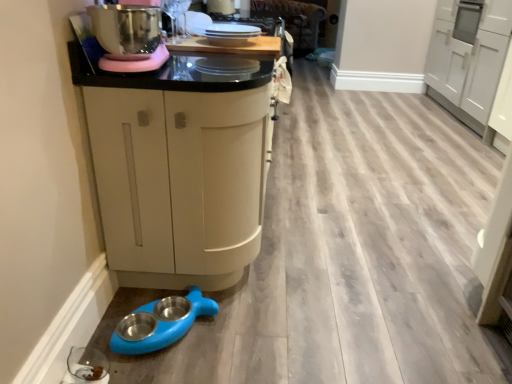
Locate an element on the screen. blue rubber pet bowls at lower left is located at coordinates (160, 323).

Measure the distance between point (203, 29) and camera.

Point (203, 29) is 6.51 feet from camera.

Locate an element on the screen. matte cream cabinet at center, which ranks as the 2th cabinetry in back-to-front order is located at coordinates (178, 169).

This screenshot has height=384, width=512. I want to click on white glossy cabinet at upper right, arranged as the 1th cabinetry when viewed from the right, so click(468, 57).

Considering the points (106, 372) and (440, 36), which point is behind, point (106, 372) or point (440, 36)?

The point (440, 36) is more distant.

Measure the distance between transparent glass bowl at lower left, which is the second appliance from right to left, and white glossy cabinet at upper right, which is the 1th cabinetry from back to front.

3.94 meters.

Which is in front, transparent glass bowl at lower left, acting as the second appliance starting from the top, or white glossy cabinet at upper right, the second cabinetry positioned from the left?

transparent glass bowl at lower left, acting as the second appliance starting from the top, is more forward.

Considering the sizes of objects transparent glass bowl at lower left, positioned as the 1th appliance in front-to-back order, and white glossy cabinet at upper right, which is the 1th cabinetry from back to front, in the image provided, who is thinner, transparent glass bowl at lower left, positioned as the 1th appliance in front-to-back order, or white glossy cabinet at upper right, which is the 1th cabinetry from back to front,?

With smaller width is transparent glass bowl at lower left, positioned as the 1th appliance in front-to-back order.

Considering the sizes of objects transparent glass bowl at lower left, the 2th appliance when ordered from back to front, and blue rubber pet bowls at lower left in the image provided, who is smaller, transparent glass bowl at lower left, the 2th appliance when ordered from back to front, or blue rubber pet bowls at lower left?

transparent glass bowl at lower left, the 2th appliance when ordered from back to front, is smaller.

Measure the distance between transparent glass bowl at lower left, the 2th appliance when ordered from back to front, and blue rubber pet bowls at lower left.

7.61 inches.

Looking at this image, is transparent glass bowl at lower left, which is counted as the first appliance, starting from the bottom, situated inside blue rubber pet bowls at lower left or outside?

transparent glass bowl at lower left, which is counted as the first appliance, starting from the bottom, is located beyond the bounds of blue rubber pet bowls at lower left.

From the image's perspective, which object appears higher, transparent glass bowl at lower left, which is the second appliance from right to left, or blue rubber pet bowls at lower left?

blue rubber pet bowls at lower left.

Where is `cabinetry lying in front of the white glossy cabinet at upper right, arranged as the 1th cabinetry when viewed from the right`? This screenshot has width=512, height=384. cabinetry lying in front of the white glossy cabinet at upper right, arranged as the 1th cabinetry when viewed from the right is located at coordinates (178, 169).

In terms of width, does matte cream cabinet at center, which is the first cabinetry from left to right, look wider or thinner when compared to white glossy cabinet at upper right, arranged as the 1th cabinetry when viewed from the right?

In the image, matte cream cabinet at center, which is the first cabinetry from left to right, appears to be more narrow than white glossy cabinet at upper right, arranged as the 1th cabinetry when viewed from the right.

Based on the photo, is white glossy cabinet at upper right, which is the 1th cabinetry from back to front, at the back of matte cream cabinet at center, the 2th cabinetry from the right?

That's not correct — matte cream cabinet at center, the 2th cabinetry from the right, is not looking away from white glossy cabinet at upper right, which is the 1th cabinetry from back to front.

From the image's perspective, which object appears higher, matte cream cabinet at center, which ranks as the 2th cabinetry in back-to-front order, or white glossy cabinet at upper right, arranged as the 1th cabinetry when viewed from the right?

white glossy cabinet at upper right, arranged as the 1th cabinetry when viewed from the right.

In the scene shown: Would you say wooden surface at upper center is part of blue rubber pet bowls at lower left's contents?

Actually, wooden surface at upper center is outside blue rubber pet bowls at lower left.

Is blue rubber pet bowls at lower left in contact with wooden surface at upper center?

blue rubber pet bowls at lower left and wooden surface at upper center are clearly separated.

From the image's perspective, is blue rubber pet bowls at lower left above wooden surface at upper center?

No, from the image's perspective, blue rubber pet bowls at lower left is not above wooden surface at upper center.

Would you say wooden surface at upper center is a long distance from white glossy cabinet at upper right, arranged as the 1th cabinetry when viewed from the right?

wooden surface at upper center is far away from white glossy cabinet at upper right, arranged as the 1th cabinetry when viewed from the right.

Is wooden surface at upper center oriented away from white glossy cabinet at upper right, the second cabinetry positioned from the left?

No, wooden surface at upper center is not facing the opposite direction of white glossy cabinet at upper right, the second cabinetry positioned from the left.

Considering the positions of objects wooden surface at upper center and white glossy cabinet at upper right, which appears as the 2th cabinetry when viewed from the front, in the image provided, who is more to the right, wooden surface at upper center or white glossy cabinet at upper right, which appears as the 2th cabinetry when viewed from the front,?

From the viewer's perspective, white glossy cabinet at upper right, which appears as the 2th cabinetry when viewed from the front, appears more on the right side.

From the image's perspective, relative to white glossy cabinet at upper right, the second cabinetry positioned from the left, is wooden surface at upper center above or below?

From the image's perspective, wooden surface at upper center appears below white glossy cabinet at upper right, the second cabinetry positioned from the left.

Is white glossy cabinet at upper right, which appears as the 2th cabinetry when viewed from the front, in front of or behind wooden surface at upper center in the image?

Visually, white glossy cabinet at upper right, which appears as the 2th cabinetry when viewed from the front, is located behind wooden surface at upper center.

Is white glossy cabinet at upper right, which is the 1th cabinetry from back to front, aimed at wooden surface at upper center?

No, white glossy cabinet at upper right, which is the 1th cabinetry from back to front, is not facing towards wooden surface at upper center.

Which of these two, white glossy cabinet at upper right, arranged as the 1th cabinetry when viewed from the right, or wooden surface at upper center, stands shorter?

Standing shorter between the two is wooden surface at upper center.

Is white glossy cabinet at upper right, which appears as the 2th cabinetry when viewed from the front, bigger than wooden surface at upper center?

Yes, white glossy cabinet at upper right, which appears as the 2th cabinetry when viewed from the front, is bigger than wooden surface at upper center.

Is white glossy plates at upper center, placed as the second appliance when sorted from bottom to top, inside or outside of transparent glass bowl at lower left, which is counted as the first appliance, starting from the bottom?

white glossy plates at upper center, placed as the second appliance when sorted from bottom to top, cannot be found inside transparent glass bowl at lower left, which is counted as the first appliance, starting from the bottom.

Is white glossy plates at upper center, positioned as the first appliance in top-to-bottom order, next to transparent glass bowl at lower left, the 2th appliance when ordered from back to front, and touching it?

No, white glossy plates at upper center, positioned as the first appliance in top-to-bottom order, is not beside transparent glass bowl at lower left, the 2th appliance when ordered from back to front.

This screenshot has width=512, height=384. In order to click on appliance above the transparent glass bowl at lower left, positioned as the 1th appliance in front-to-back order (from the image's perspective) in this screenshot , I will do `click(229, 33)`.

From a real-world perspective, which cabinetry is the 2nd one above the transparent glass bowl at lower left, positioned as the 1th appliance in front-to-back order? Please provide its 2D coordinates.

[(468, 57)]

Locate an element on the screen. The width and height of the screenshot is (512, 384). appliance on the left of blue rubber pet bowls at lower left is located at coordinates click(86, 366).

Based on the photo, based on their spatial positions, is transparent glass bowl at lower left, the 2th appliance when ordered from back to front, or matte cream cabinet at center, which ranks as the 2th cabinetry in back-to-front order, closer to wooden surface at upper center?

matte cream cabinet at center, which ranks as the 2th cabinetry in back-to-front order, is positioned closer to the anchor wooden surface at upper center.

Estimate the real-world distances between objects in this image. Which object is further from matte cream cabinet at center, which is the first cabinetry from left to right, white glossy plates at upper center, which is the 1th appliance in right-to-left order, or wooden surface at upper center?

white glossy plates at upper center, which is the 1th appliance in right-to-left order, is positioned further to the anchor matte cream cabinet at center, which is the first cabinetry from left to right.

Based on their spatial positions, is white glossy cabinet at upper right, the second cabinetry positioned from the left, or matte cream cabinet at center, which ranks as the 2th cabinetry in back-to-front order, closer to white glossy plates at upper center, arranged as the first appliance when viewed from the back?

Based on the image, matte cream cabinet at center, which ranks as the 2th cabinetry in back-to-front order, appears to be nearer to white glossy plates at upper center, arranged as the first appliance when viewed from the back.

When comparing their distances from transparent glass bowl at lower left, acting as the second appliance starting from the top, does matte cream cabinet at center, acting as the 1th cabinetry starting from the front, or white glossy plates at upper center, positioned as the first appliance in top-to-bottom order, seem further?

white glossy plates at upper center, positioned as the first appliance in top-to-bottom order, lies further to transparent glass bowl at lower left, acting as the second appliance starting from the top, than the other object.

From the image, which object appears to be farther from white glossy plates at upper center, placed as the 2th appliance when sorted from left to right, transparent glass bowl at lower left, acting as the second appliance starting from the top, or blue rubber pet bowls at lower left?

transparent glass bowl at lower left, acting as the second appliance starting from the top.

Estimate the real-world distances between objects in this image. Which object is further from blue rubber pet bowls at lower left, transparent glass bowl at lower left, which is counted as the first appliance, starting from the bottom, or white glossy plates at upper center, which is the 1th appliance in right-to-left order?

white glossy plates at upper center, which is the 1th appliance in right-to-left order.

From the image, which object appears to be nearer to white glossy plates at upper center, positioned as the first appliance in top-to-bottom order, blue rubber pet bowls at lower left or wooden surface at upper center?

wooden surface at upper center lies closer to white glossy plates at upper center, positioned as the first appliance in top-to-bottom order, than the other object.

Based on their spatial positions, is transparent glass bowl at lower left, which is the second appliance from right to left, or blue rubber pet bowls at lower left closer to white glossy cabinet at upper right, which appears as the 2th cabinetry when viewed from the front?

blue rubber pet bowls at lower left.

Where is `cabinetry between wooden surface at upper center and blue rubber pet bowls at lower left in the up-down direction`? The height and width of the screenshot is (384, 512). cabinetry between wooden surface at upper center and blue rubber pet bowls at lower left in the up-down direction is located at coordinates (178, 169).

Where is `cabinetry between transparent glass bowl at lower left, acting as the second appliance starting from the top, and white glossy cabinet at upper right, arranged as the 1th cabinetry when viewed from the right, from left to right`? This screenshot has width=512, height=384. cabinetry between transparent glass bowl at lower left, acting as the second appliance starting from the top, and white glossy cabinet at upper right, arranged as the 1th cabinetry when viewed from the right, from left to right is located at coordinates (178, 169).

You are a GUI agent. You are given a task and a screenshot of the screen. Output one action in this format:
    pyautogui.click(x=<x>, y=<y>)
    Task: Click on the appliance between transparent glass bowl at lower left, which is the second appliance from right to left, and white glossy cabinet at upper right, the second cabinetry positioned from the left, in the horizontal direction
    
    Given the screenshot: What is the action you would take?
    pyautogui.click(x=229, y=33)

Find the location of a particular element. appliance situated between wooden surface at upper center and white glossy cabinet at upper right, arranged as the 1th cabinetry when viewed from the right, from left to right is located at coordinates (229, 33).